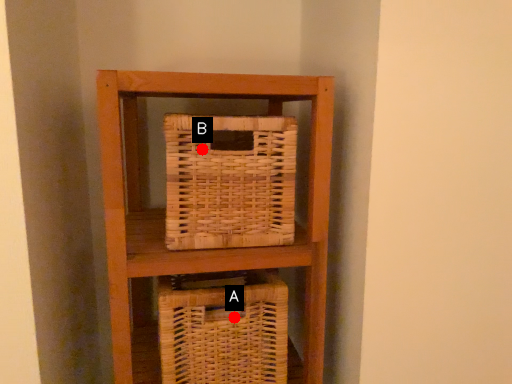
Question: Two points are circled on the image, labeled by A and B beside each circle. Which point is farther to the camera?

Choices:
 (A) A is further
 (B) B is further

Answer: (A)